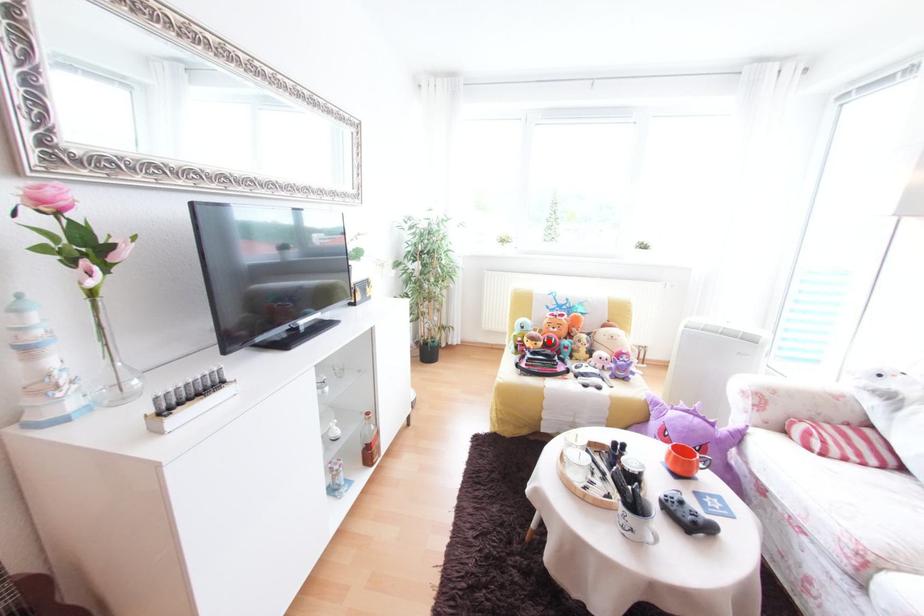
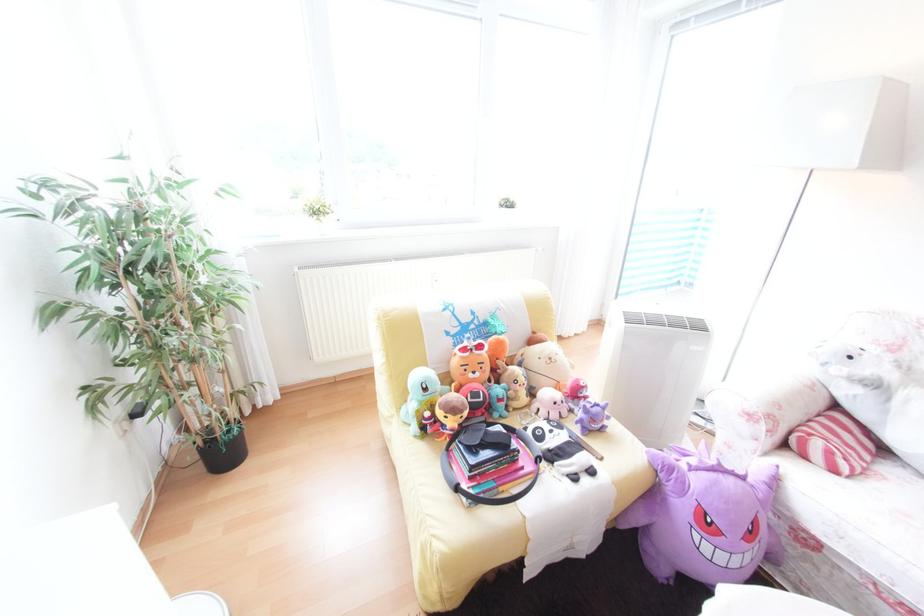
In the second image, find the point that corresponds to the highlighted location in the first image.

(476, 408)